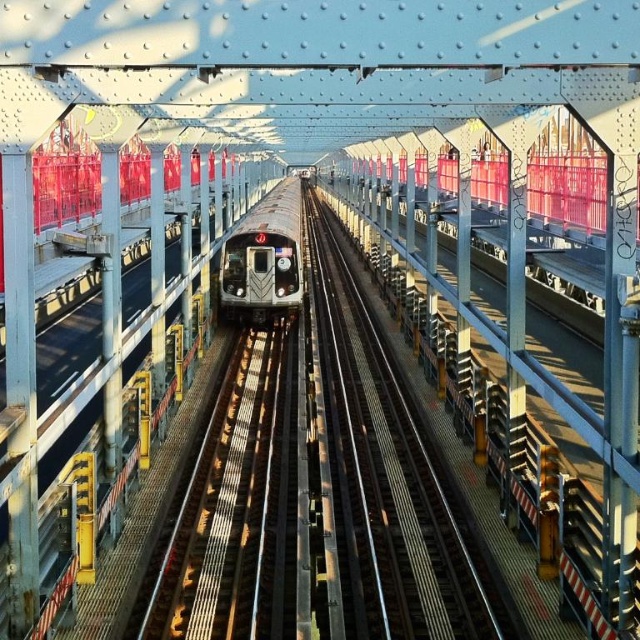
Is metal train track at center to the right of silver metallic train at center from the viewer's perspective?

Indeed, metal train track at center is positioned on the right side of silver metallic train at center.

Which is behind, point (333, 435) or point (289, 218)?

Positioned behind is point (289, 218).

Where is `metal train track at center`? This screenshot has height=640, width=640. metal train track at center is located at coordinates (388, 477).